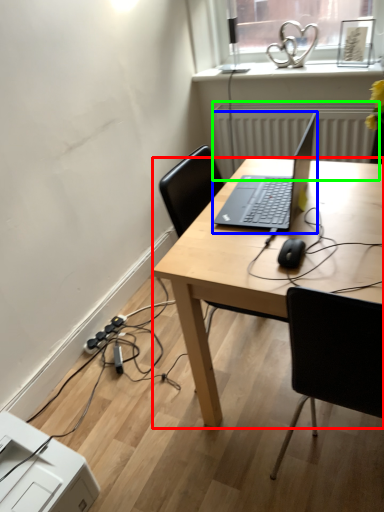
Question: Estimate the real-world distances between objects in this image. Which object is farther from desk (highlighted by a red box), laptop (highlighted by a blue box) or radiator (highlighted by a green box)?

Choices:
 (A) laptop
 (B) radiator

Answer: (B)